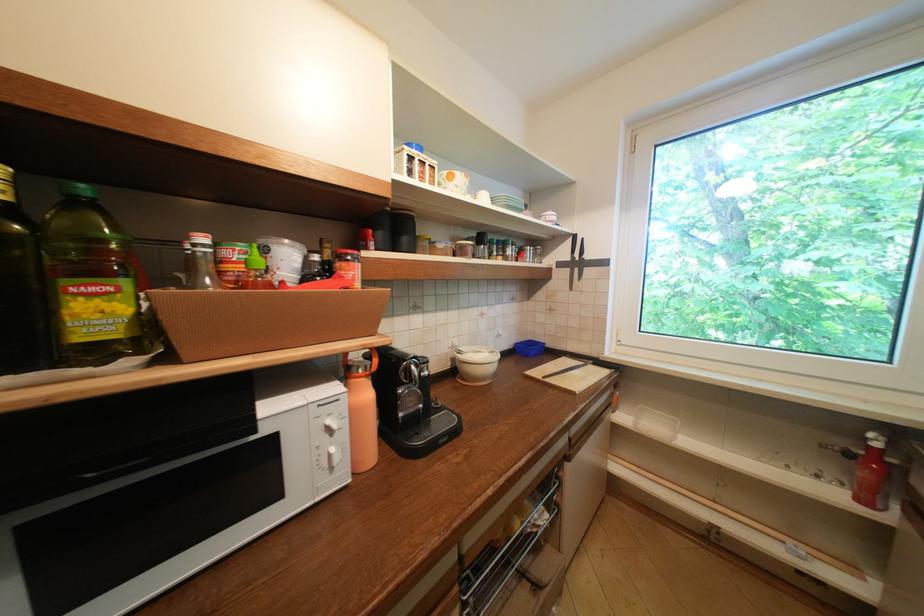
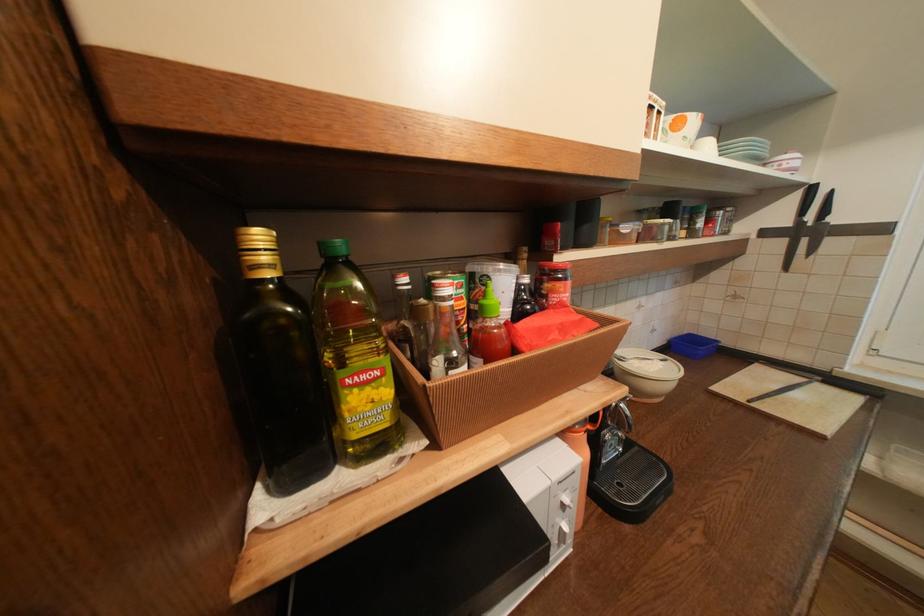
Consider the image. Which direction would the cameraman need to move to produce the second image?

The cameraman moved toward left, forward.